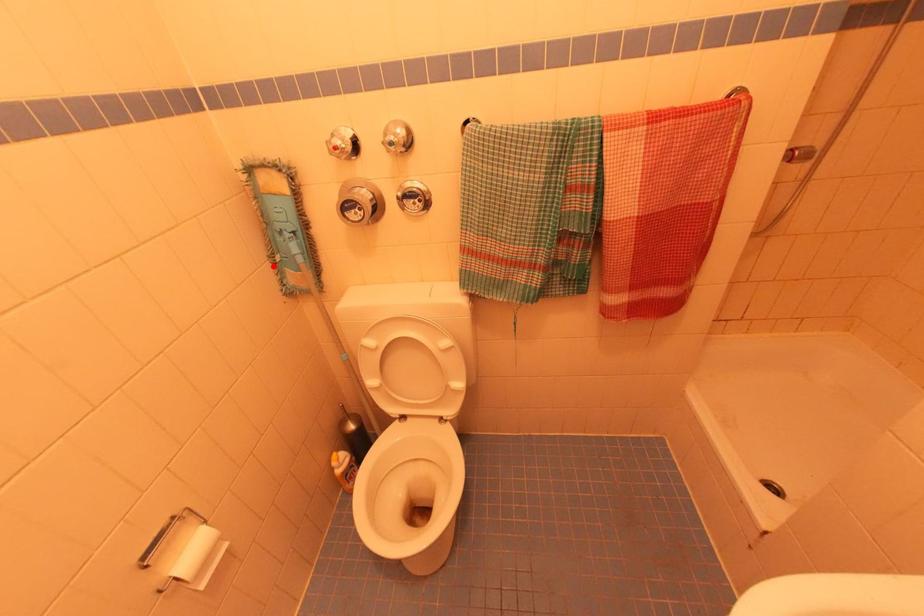
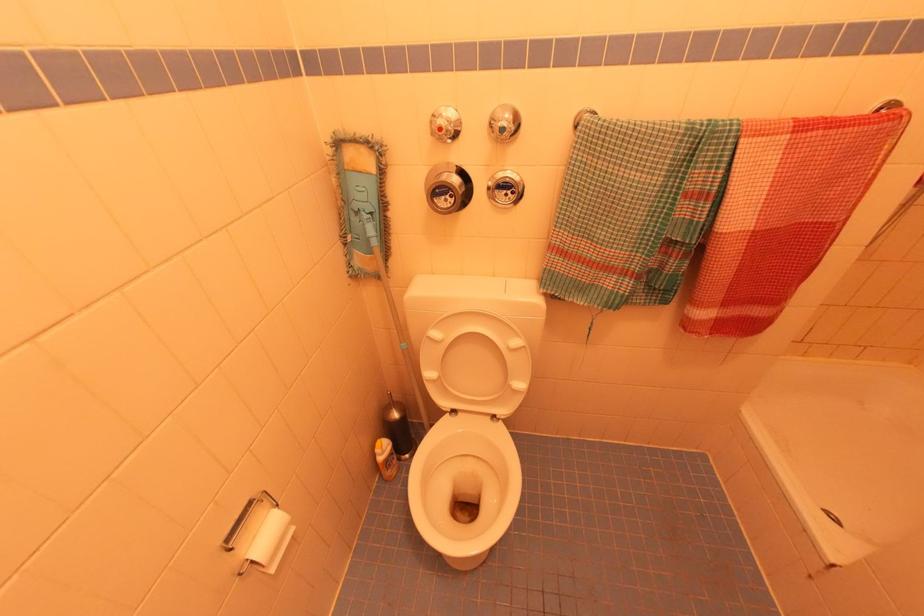
Locate, in the second image, the point that corresponds to the highlighted location in the first image.

(344, 246)